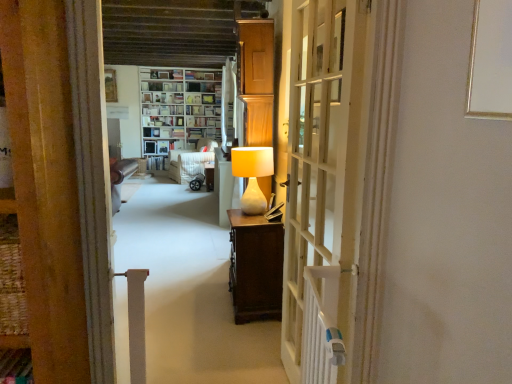
Question: Considering their positions, is wooden picture frame at upper center located in front of or behind matte white lamp at center?

Choices:
 (A) behind
 (B) front

Answer: (A)

Question: Is wooden picture frame at upper center wider or thinner than matte white lamp at center?

Choices:
 (A) wide
 (B) thin

Answer: (B)

Question: Estimate the real-world distances between objects in this image. Which object is closer to the white wooden bookshelf at center?

Choices:
 (A) white fabric armchair at center
 (B) wooden picture frame at upper center
 (C) white sheer curtain at upper center
 (D) matte white lamp at center
 (E) white wooden door at center

Answer: (A)

Question: Which is farther from the white sheer curtain at upper center?

Choices:
 (A) wooden picture frame at upper center
 (B) white wooden door at center
 (C) white fabric armchair at center
 (D) white wooden bookshelf at center
 (E) matte white lamp at center

Answer: (B)